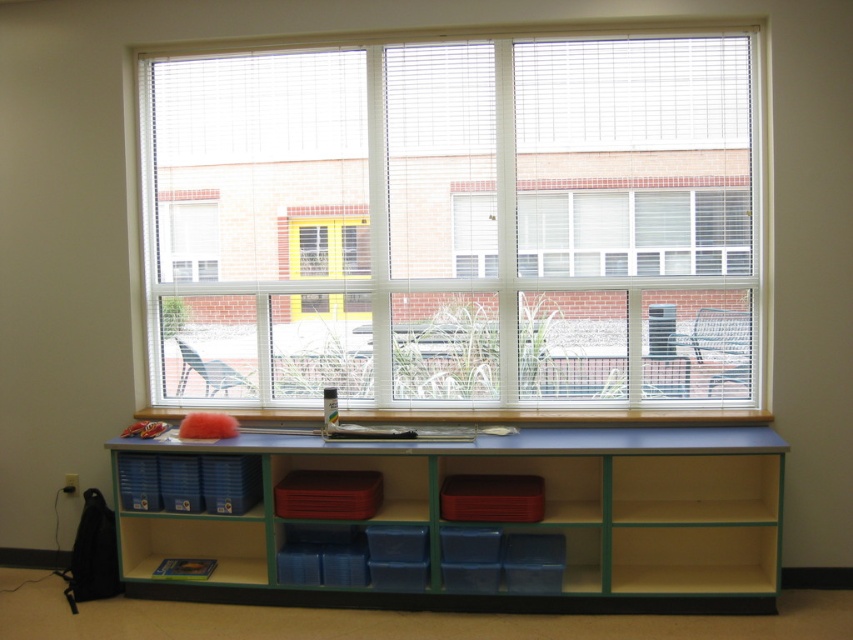
You are standing in the classroom and want to reach the point marked at coordinates point (631,604). Considering the storage unit and other objects in the scene, is there enough space for you to walk directly to that point?

The distance between point (631,604) and the viewer is 3.43 meters. Since there are no obstacles mentioned between the viewer and the point, assuming a clear path, you can walk directly to the point.

You are a student looking for your backpack in the classroom. You see the blue plastic bookshelf at center and the wooden at lower center. Which object is closer to you?

The blue plastic bookshelf at center is closer to you because it is in front of the wooden at lower center.